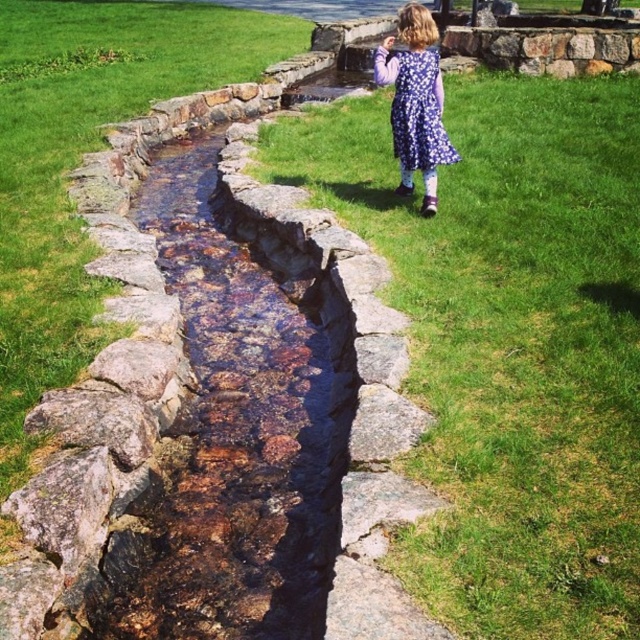
You are a parent trying to decide if your child can walk safely across the green grass at center to reach the purple floral dress at upper right. Based on the height difference between the grass and the dress, do you think the grass might obstruct the child from seeing the dress?

The green grass at center is much taller than the purple floral dress at upper right. Since the grass is taller, it could potentially obstruct the child from seeing the dress clearly, making it difficult to navigate towards it safely.

You are standing in the outdoor scene and want to place a small garden gnome exactly at the center of the green grass at center. According to the coordinates provided, what are the coordinates where you should place the gnome?

The coordinates for placing the garden gnome at the center of the green grass at center are exactly at point [509,340].